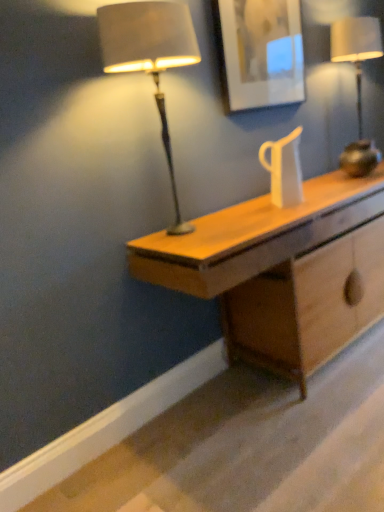
What are the coordinates of `free location to the right of matte brown lamp at left, placed as the 2th lamp when sorted from right to left` in the screenshot? It's located at (249, 222).